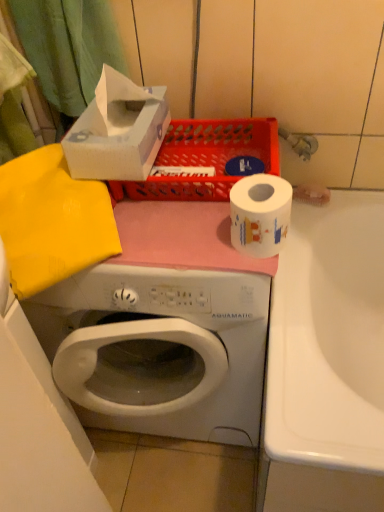
Question: From the image's perspective, is matte plastic basket at upper center over white cardboard tissue box at upper left?

Choices:
 (A) yes
 (B) no

Answer: (B)

Question: From the image's perspective, is matte plastic basket at upper center beneath white cardboard tissue box at upper left?

Choices:
 (A) no
 (B) yes

Answer: (B)

Question: Does matte plastic basket at upper center turn towards white cardboard tissue box at upper left?

Choices:
 (A) no
 (B) yes

Answer: (A)

Question: Can you confirm if matte plastic basket at upper center is smaller than white cardboard tissue box at upper left?

Choices:
 (A) no
 (B) yes

Answer: (A)

Question: Considering the relative sizes of matte plastic basket at upper center and white cardboard tissue box at upper left in the image provided, is matte plastic basket at upper center bigger than white cardboard tissue box at upper left?

Choices:
 (A) no
 (B) yes

Answer: (B)

Question: Is matte plastic basket at upper center closer to the viewer compared to white cardboard tissue box at upper left?

Choices:
 (A) yes
 (B) no

Answer: (B)

Question: Considering the relative sizes of matte plastic basket at upper center and white glossy toilet paper at center in the image provided, is matte plastic basket at upper center wider than white glossy toilet paper at center?

Choices:
 (A) no
 (B) yes

Answer: (B)

Question: From the image's perspective, is matte plastic basket at upper center under white glossy toilet paper at center?

Choices:
 (A) yes
 (B) no

Answer: (B)

Question: Is matte plastic basket at upper center located outside white glossy toilet paper at center?

Choices:
 (A) yes
 (B) no

Answer: (A)

Question: From a real-world perspective, is matte plastic basket at upper center physically below white glossy toilet paper at center?

Choices:
 (A) yes
 (B) no

Answer: (A)

Question: Does matte plastic basket at upper center lie behind white glossy toilet paper at center?

Choices:
 (A) no
 (B) yes

Answer: (B)

Question: Is matte plastic basket at upper center positioned in front of white glossy toilet paper at center?

Choices:
 (A) no
 (B) yes

Answer: (A)

Question: From the image's perspective, does white cardboard tissue box at upper left appear lower than matte plastic basket at upper center?

Choices:
 (A) no
 (B) yes

Answer: (A)